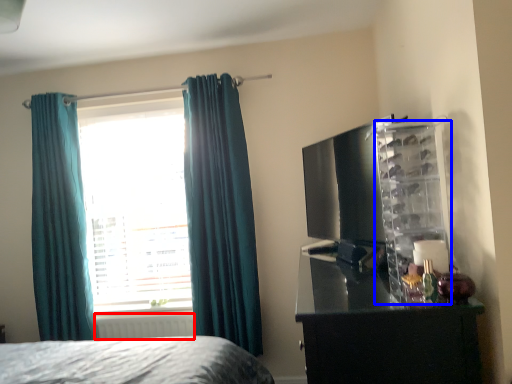
Question: Which object appears closest to the camera in this image, radiator (highlighted by a red box) or cabinet (highlighted by a blue box)?

Choices:
 (A) radiator
 (B) cabinet

Answer: (B)